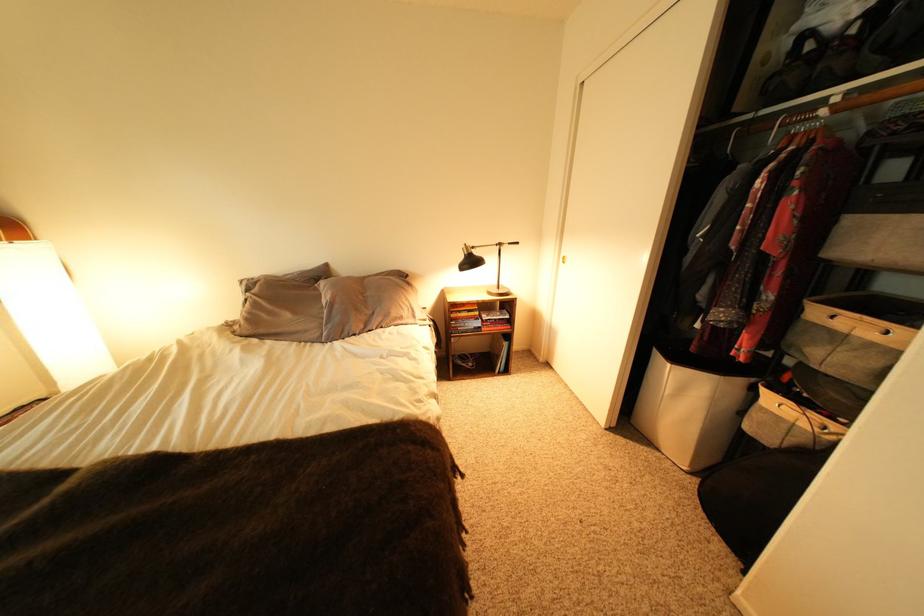
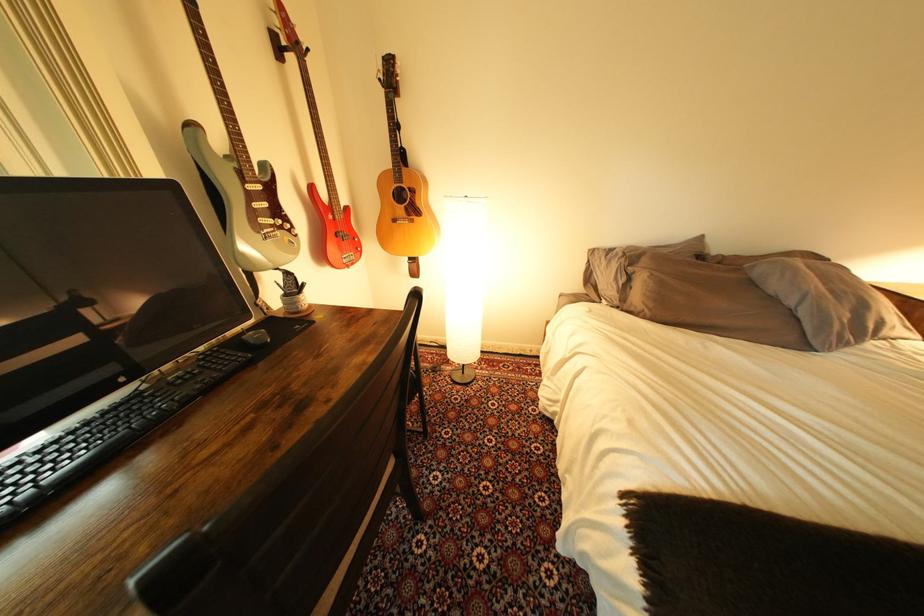
Where in the second image is the point corresponding to the point at 274,333 from the first image?

(701, 322)